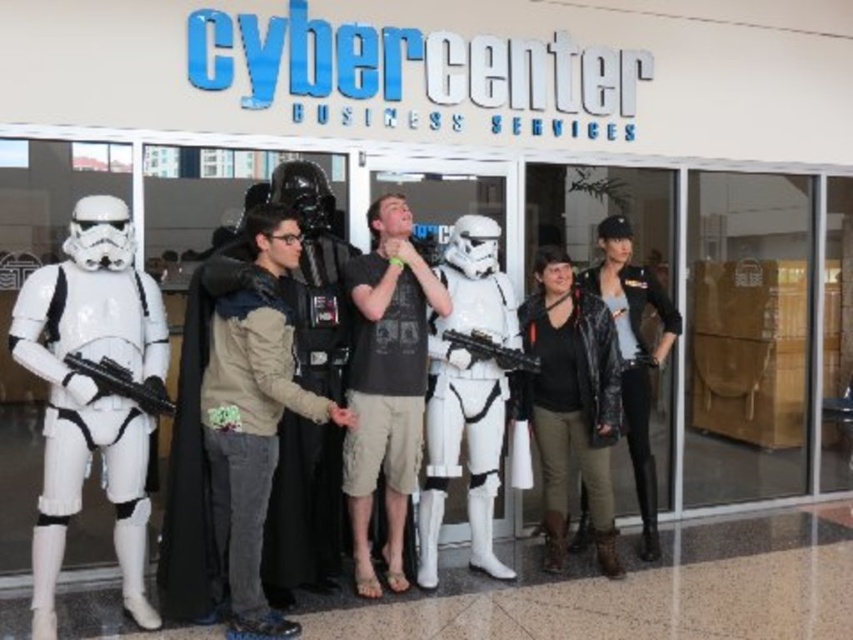
Question: Which object is positioned farthest from the dark matte costume at center?

Choices:
 (A) matte black gun at center
 (B) black cotton t-shirt at center
 (C) black matte gun at center
 (D) white matte stormtrooper at center

Answer: (C)

Question: Does matte black gun at center appear under black matte gun at center?

Choices:
 (A) no
 (B) yes

Answer: (B)

Question: Among these objects, which one is farthest from the camera?

Choices:
 (A) dark matte costume at center
 (B) black cotton t-shirt at center
 (C) matte black gun at center
 (D) leather jacket at right

Answer: (D)

Question: Does white matte stormtrooper at left have a lesser width compared to black leather jacket at lower right?

Choices:
 (A) no
 (B) yes

Answer: (A)

Question: Among these points, which one is farthest from the camera?

Choices:
 (A) (221, 484)
 (B) (97, 360)
 (C) (102, 454)

Answer: (C)

Question: Can you confirm if white matte stormtrooper at center is positioned to the left of black matte gun at center?

Choices:
 (A) yes
 (B) no

Answer: (A)